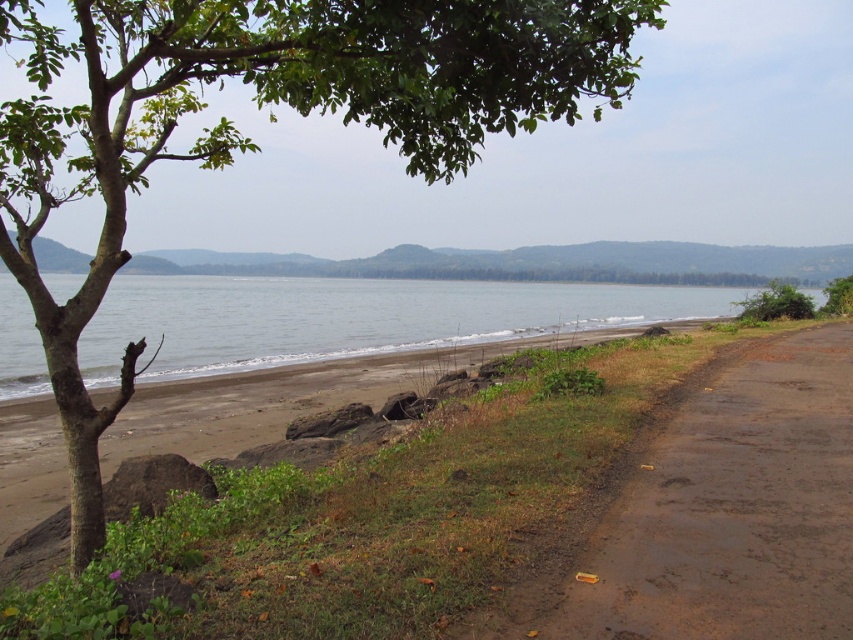
You are standing at the point marked as point (733, 509) in the lower right corner of the image. What type of surface are you currently standing on?

You are standing on dull brown asphalt at lower right, as indicated by the coordinates provided.

You are standing on the dull brown asphalt at lower right and want to walk to the gray smooth water at center. Is the path clear? Explain using the scene details.

The dull brown asphalt at lower right is in front of the gray smooth water at center, which means there is no obstruction between them. Therefore, the path is clear for you to walk from the dull brown asphalt at lower right to the gray smooth water at center.

You are standing at the center of the image and want to walk towards the dull brown asphalt at lower right. There is a green leafy tree at right in your path. Can you walk around the tree to reach the asphalt without going through it?

The dull brown asphalt at lower right might be wider than green leafy tree at right, so there could be enough space to walk around the tree and reach the asphalt without going through it.